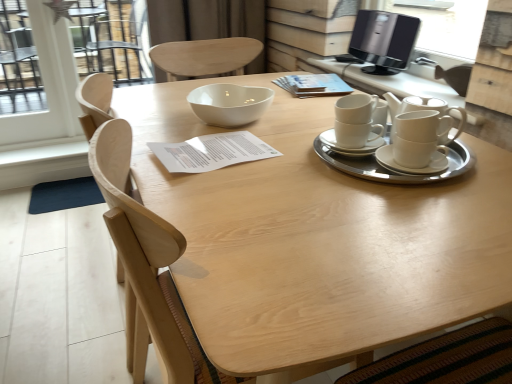
Question: Considering the relative positions of light wood chair at center and white ceramic tea set at right in the image provided, is light wood chair at center to the right of white ceramic tea set at right from the viewer's perspective?

Choices:
 (A) yes
 (B) no

Answer: (B)

Question: Does light wood chair at center have a greater width compared to white ceramic tea set at right?

Choices:
 (A) no
 (B) yes

Answer: (B)

Question: From a real-world perspective, is light wood chair at center on top of white ceramic tea set at right?

Choices:
 (A) yes
 (B) no

Answer: (B)

Question: Is the position of light wood chair at center less distant than that of white ceramic tea set at right?

Choices:
 (A) no
 (B) yes

Answer: (A)

Question: Is light wood chair at center smaller than white ceramic tea set at right?

Choices:
 (A) yes
 (B) no

Answer: (B)

Question: Considering their positions, is white ceramic cups at upper right, the second table ordered from the bottom, located in front of or behind natural wood table at center, which is the 1th table in bottom-to-top order?

Choices:
 (A) behind
 (B) front

Answer: (A)

Question: Is white ceramic cups at upper right, the second table ordered from the bottom, inside the boundaries of natural wood table at center, the 2th table viewed from the top, or outside?

Choices:
 (A) inside
 (B) outside

Answer: (B)

Question: From a real-world perspective, is white ceramic cups at upper right, which appears as the first table when viewed from the top, positioned above or below natural wood table at center, the 2th table viewed from the top?

Choices:
 (A) above
 (B) below

Answer: (A)

Question: Is white ceramic cups at upper right, the second table ordered from the bottom, bigger or smaller than natural wood table at center, which is the 1th table in bottom-to-top order?

Choices:
 (A) small
 (B) big

Answer: (A)

Question: Would you say white glossy bowl at center is to the left or to the right of black glossy computer monitor at upper right in the picture?

Choices:
 (A) left
 (B) right

Answer: (A)

Question: From the image's perspective, is white glossy bowl at center above or below black glossy computer monitor at upper right?

Choices:
 (A) above
 (B) below

Answer: (B)

Question: From a real-world perspective, is white glossy bowl at center above or below black glossy computer monitor at upper right?

Choices:
 (A) below
 (B) above

Answer: (A)

Question: In the image, is white glossy bowl at center positioned in front of or behind black glossy computer monitor at upper right?

Choices:
 (A) front
 (B) behind

Answer: (A)

Question: Considering their positions, is black glossy computer monitor at upper right located in front of or behind white glossy bowl at center?

Choices:
 (A) behind
 (B) front

Answer: (A)

Question: Is black glossy computer monitor at upper right inside or outside of white glossy bowl at center?

Choices:
 (A) inside
 (B) outside

Answer: (B)